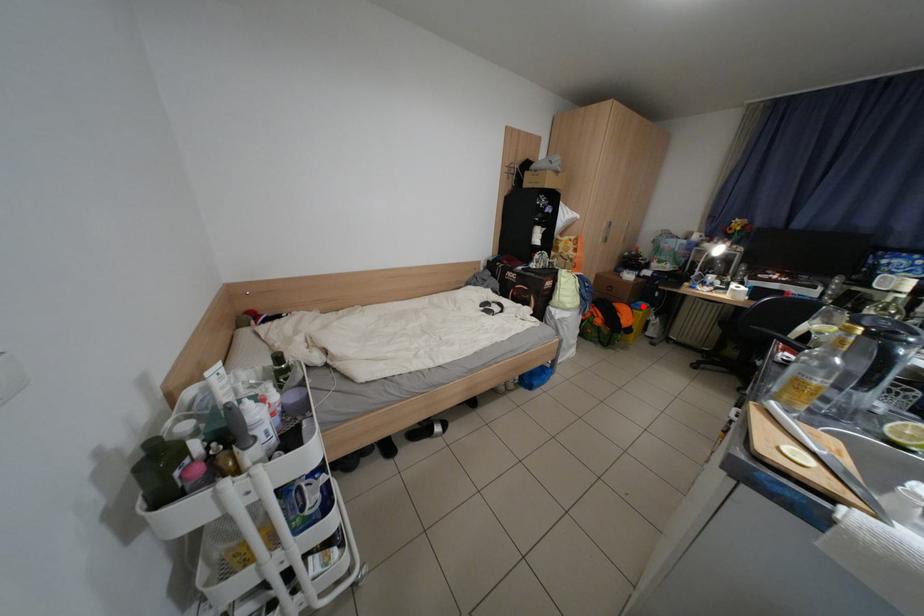
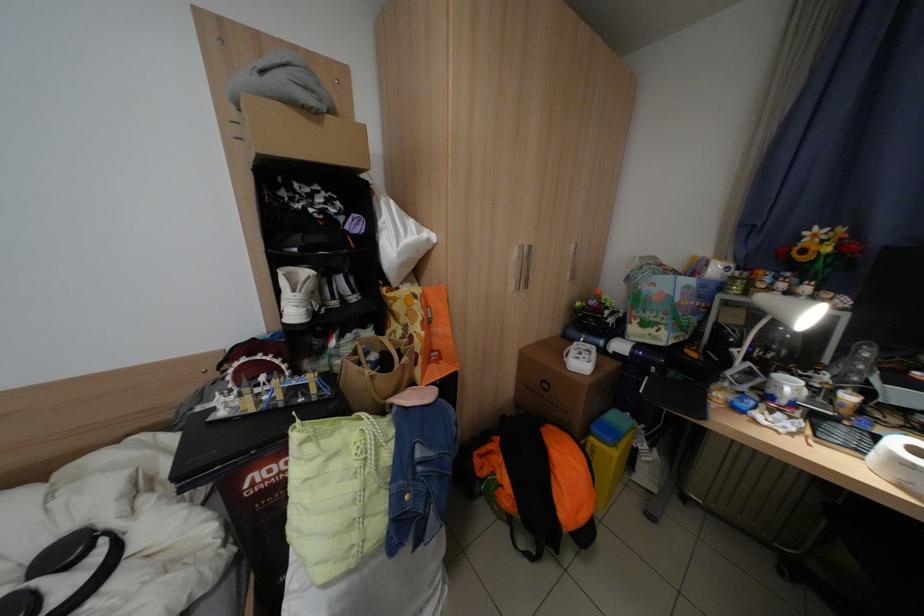
Question: I am providing you with two images of the same scene from different viewpoints. In image1, a red point is highlighted. Considering the same 3D point in image2, which of the following is correct?

Choices:
 (A) It is closer
 (B) It is farther

Answer: (B)